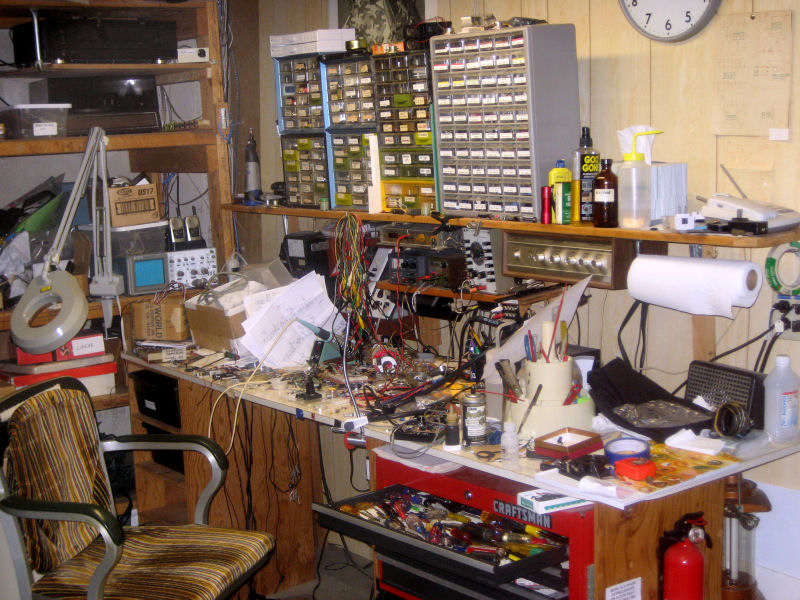
Find the location of a particular element. This screenshot has width=800, height=600. cables is located at coordinates (210, 416), (248, 440), (294, 458), (328, 486), (630, 314), (770, 310), (762, 360), (168, 117), (180, 187).